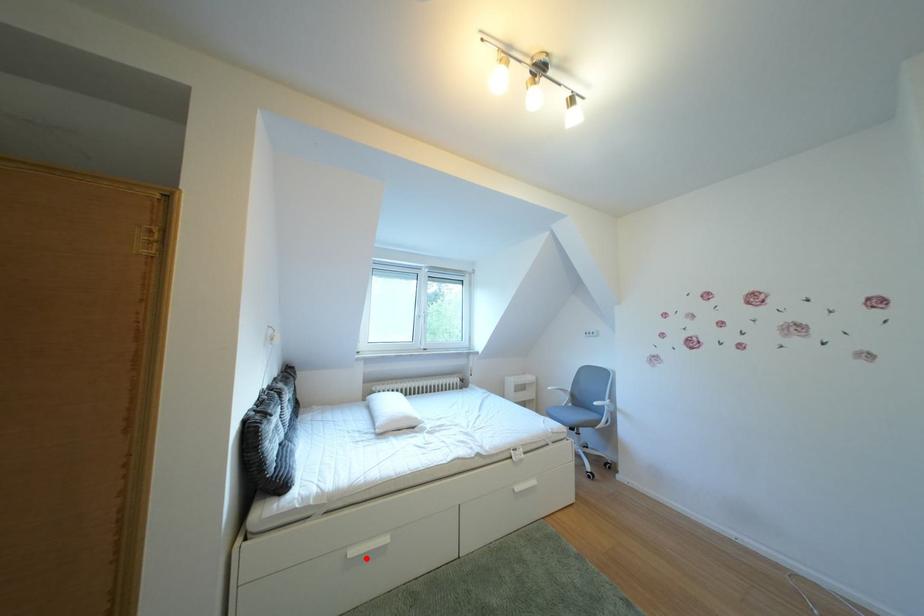
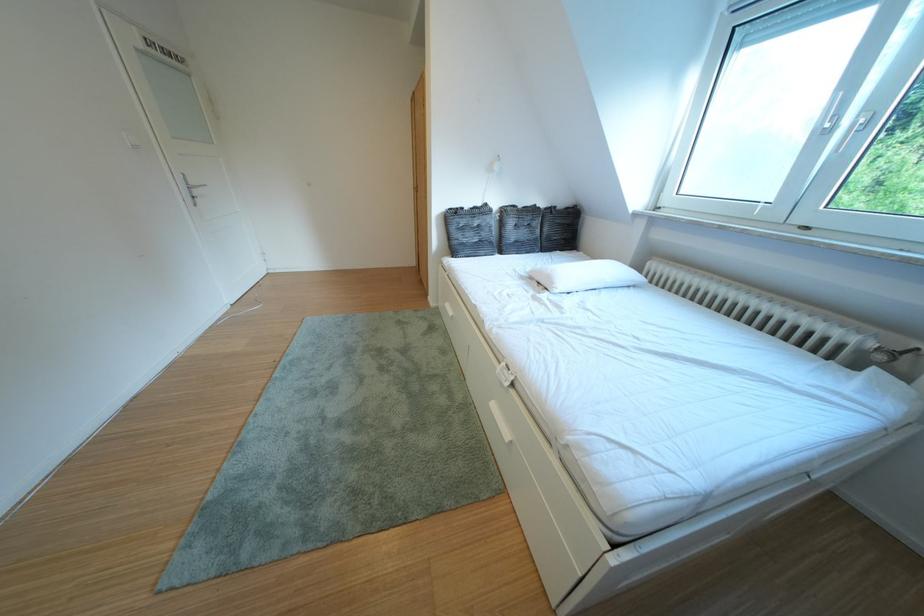
The point at the highlighted location is marked in the first image. Where is the corresponding point in the second image?

(460, 310)